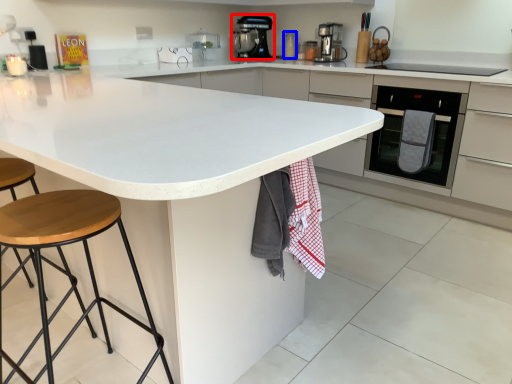
Question: Which object is further to the camera taking this photo, kitchen appliance (highlighted by a red box) or appliance (highlighted by a blue box)?

Choices:
 (A) kitchen appliance
 (B) appliance

Answer: (B)